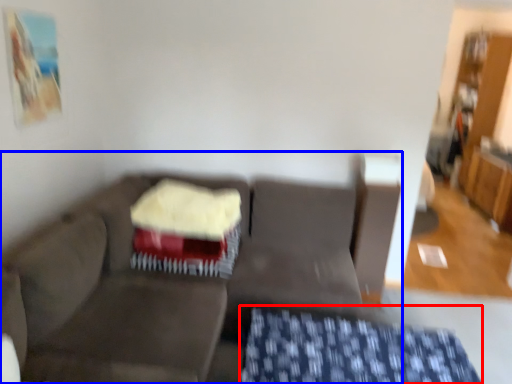
Question: Which of the following is the closest to the observer, tablecloth (highlighted by a red box) or studio couch (highlighted by a blue box)?

Choices:
 (A) tablecloth
 (B) studio couch

Answer: (B)